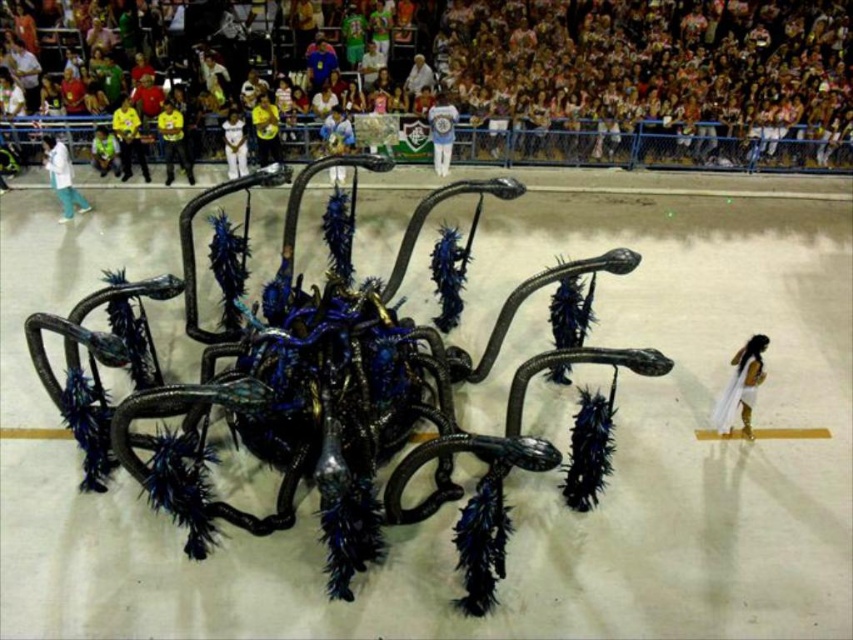
Question: Can you confirm if multicolored fabric crowd at upper center is positioned to the left of white matte pants at left?

Choices:
 (A) yes
 (B) no

Answer: (B)

Question: Which of the following is the farthest from the observer?

Choices:
 (A) yellow fabric shirt at center
 (B) yellow fabric at center
 (C) blue metallic costume at center
 (D) metallic blue spider at center

Answer: (A)

Question: Based on their relative distances, which object is farther from the white fabric pants at center?

Choices:
 (A) blue metallic costume at center
 (B) yellow fabric at upper left
 (C) multicolored fabric crowd at upper center
 (D) green matte shirt at upper left

Answer: (D)

Question: Which of these objects is positioned closest to the yellow fabric shirt at center?

Choices:
 (A) blue metallic costume at center
 (B) white fabric dress at center
 (C) green matte shirt at upper left
 (D) multicolored fabric crowd at upper center

Answer: (B)

Question: Is white silk dress at lower right further to camera compared to yellow fabric shirt at center?

Choices:
 (A) yes
 (B) no

Answer: (B)

Question: Does yellow fabric at center appear over white fabric pants at center?

Choices:
 (A) yes
 (B) no

Answer: (B)